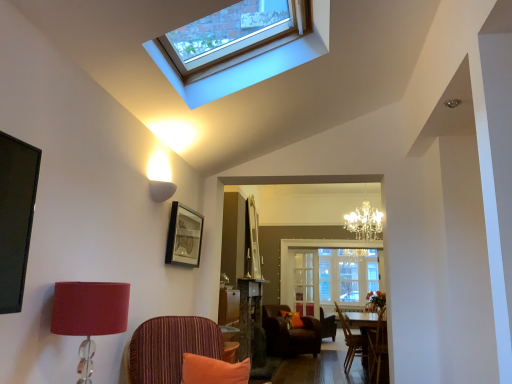
Question: Is wooden chair at lower right, which is the third chair from front to back, at the left side of striped fabric chair at center, the first chair from the front?

Choices:
 (A) yes
 (B) no

Answer: (B)

Question: Can you confirm if wooden chair at lower right, acting as the second chair starting from the back, is wider than striped fabric chair at center, which is counted as the 4th chair, starting from the back?

Choices:
 (A) no
 (B) yes

Answer: (A)

Question: From the image's perspective, is wooden chair at lower right, which is the third chair from front to back, on striped fabric chair at center, which is counted as the 4th chair, starting from the back?

Choices:
 (A) yes
 (B) no

Answer: (B)

Question: Considering the relative sizes of wooden chair at lower right, acting as the second chair starting from the back, and striped fabric chair at center, which is counted as the 4th chair, starting from the back, in the image provided, is wooden chair at lower right, acting as the second chair starting from the back, smaller than striped fabric chair at center, which is counted as the 4th chair, starting from the back,?

Choices:
 (A) no
 (B) yes

Answer: (B)

Question: Is striped fabric chair at center, the first chair from the front, completely or partially inside wooden chair at lower right, which is the third chair from front to back?

Choices:
 (A) no
 (B) yes

Answer: (A)

Question: Would you say brown leather armchair at center, the 1th chair viewed from the back, is to the left or to the right of white glass window screen at center in the picture?

Choices:
 (A) right
 (B) left

Answer: (B)

Question: From their relative heights in the image, would you say brown leather armchair at center, which is counted as the fourth chair, starting from the front, is taller or shorter than white glass window screen at center?

Choices:
 (A) short
 (B) tall

Answer: (A)

Question: Does point (287, 344) appear closer or farther from the camera than point (305, 278)?

Choices:
 (A) closer
 (B) farther

Answer: (A)

Question: Relative to white glass window screen at center, is brown leather armchair at center, the 1th chair viewed from the back, in front or behind?

Choices:
 (A) behind
 (B) front

Answer: (B)

Question: Is point (177, 322) positioned closer to the camera than point (221, 375)?

Choices:
 (A) closer
 (B) farther

Answer: (B)

Question: Is striped fabric chair at center, the first chair from the front, spatially inside orange fabric pillow at lower center, which ranks as the 2th pillow in right-to-left order, or outside of it?

Choices:
 (A) outside
 (B) inside

Answer: (A)

Question: Is striped fabric chair at center, the first chair from the front, in front of or behind orange fabric pillow at lower center, placed as the first pillow when sorted from front to back, in the image?

Choices:
 (A) front
 (B) behind

Answer: (A)

Question: From a real-world perspective, relative to orange fabric pillow at lower center, which ranks as the 2th pillow in right-to-left order, is striped fabric chair at center, which is counted as the 4th chair, starting from the back, vertically above or below?

Choices:
 (A) above
 (B) below

Answer: (A)

Question: Looking at their shapes, would you say clear glass cabinet at center is wider or thinner than white glass window screen at center?

Choices:
 (A) thin
 (B) wide

Answer: (A)

Question: Would you say clear glass cabinet at center is inside or outside white glass window screen at center?

Choices:
 (A) inside
 (B) outside

Answer: (A)